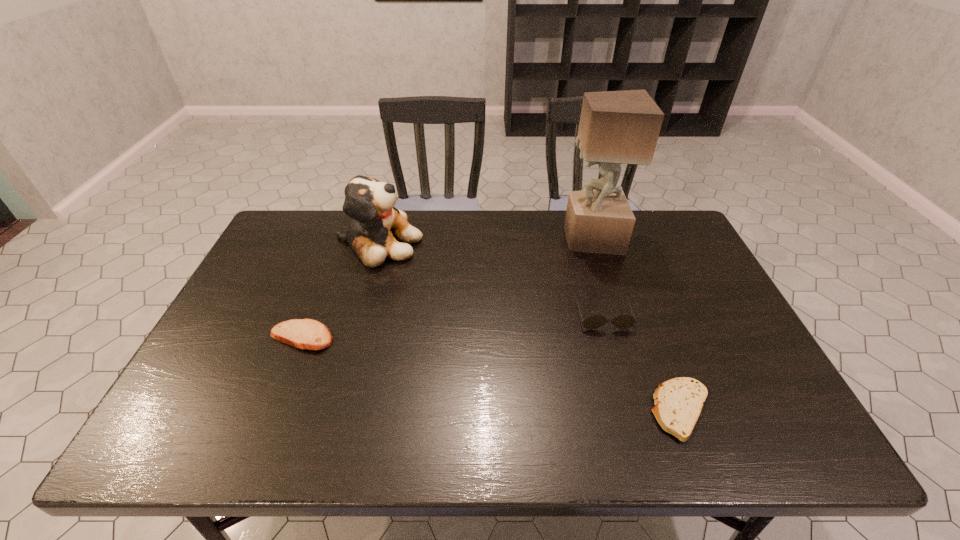
Where is `the tallest object`? the tallest object is located at coordinates (616, 127).

You are a GUI agent. You are given a task and a screenshot of the screen. Output one action in this format:
    pyautogui.click(x=<x>, y=<y>)
    Task: Click on the puppy
    This screenshot has height=540, width=960.
    Given the screenshot: What is the action you would take?
    pyautogui.click(x=375, y=224)

This screenshot has height=540, width=960. I want to click on the third shortest object, so click(x=623, y=321).

Identify the location of the farther pita bread. This screenshot has width=960, height=540. (308, 334).

In order to click on the right pita bread in this screenshot , I will do coord(678,402).

At what (x,y) coordinates should I click in order to perform the action: click on the shortest object. Please return your answer as a coordinate pair (x, y). This screenshot has width=960, height=540. Looking at the image, I should click on (678, 402).

The height and width of the screenshot is (540, 960). Find the location of `vacant space positioned 0.400m on the front-facing side of the tallest object`. vacant space positioned 0.400m on the front-facing side of the tallest object is located at coordinates (443, 239).

Identify the location of blank area located 0.390m on the front-facing side of the tallest object. (445, 239).

At what (x,y) coordinates should I click in order to perform the action: click on vacant space located 0.270m on the front-facing side of the tallest object. Please return your answer as a coordinate pair (x, y). Looking at the image, I should click on 482,239.

This screenshot has height=540, width=960. I want to click on blank space located at the face of the puppy, so tap(441, 243).